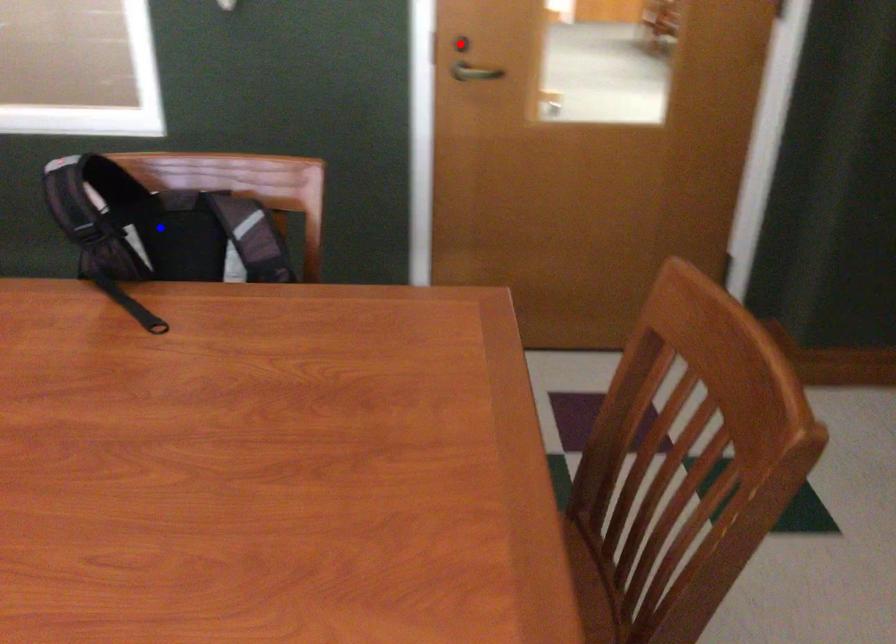
Question: Which of the two points in the image is closer to the camera?

Choices:
 (A) Blue point is closer.
 (B) Red point is closer.

Answer: (A)